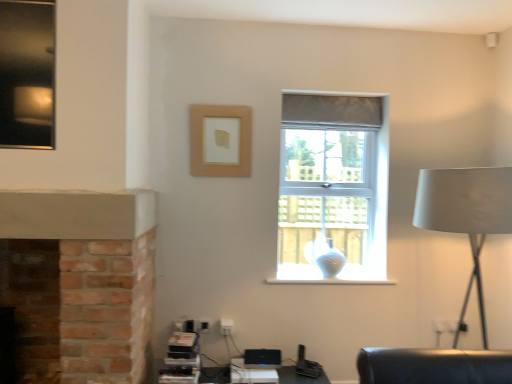
Question: Is white matte table lamp at right to the right of clear glass window at center from the viewer's perspective?

Choices:
 (A) no
 (B) yes

Answer: (B)

Question: From the image's perspective, is white matte table lamp at right below clear glass window at center?

Choices:
 (A) no
 (B) yes

Answer: (B)

Question: Can you confirm if white matte table lamp at right is positioned to the left of clear glass window at center?

Choices:
 (A) no
 (B) yes

Answer: (A)

Question: Is white matte table lamp at right beside clear glass window at center?

Choices:
 (A) yes
 (B) no

Answer: (B)

Question: From the image's perspective, would you say white matte table lamp at right is positioned over clear glass window at center?

Choices:
 (A) yes
 (B) no

Answer: (B)

Question: Would you say white matte table lamp at right is outside clear glass window at center?

Choices:
 (A) no
 (B) yes

Answer: (B)

Question: From the image's perspective, is beige matte picture frame at upper center on clear glass window at center?

Choices:
 (A) yes
 (B) no

Answer: (A)

Question: Can you confirm if beige matte picture frame at upper center is smaller than clear glass window at center?

Choices:
 (A) no
 (B) yes

Answer: (B)

Question: Does beige matte picture frame at upper center have a larger size compared to clear glass window at center?

Choices:
 (A) no
 (B) yes

Answer: (A)

Question: Is beige matte picture frame at upper center positioned behind clear glass window at center?

Choices:
 (A) no
 (B) yes

Answer: (A)

Question: Is beige matte picture frame at upper center facing towards clear glass window at center?

Choices:
 (A) no
 (B) yes

Answer: (A)

Question: Is beige matte picture frame at upper center in contact with clear glass window at center?

Choices:
 (A) no
 (B) yes

Answer: (A)

Question: Is translucent glass vase at window taller than clear glass window at center?

Choices:
 (A) no
 (B) yes

Answer: (A)